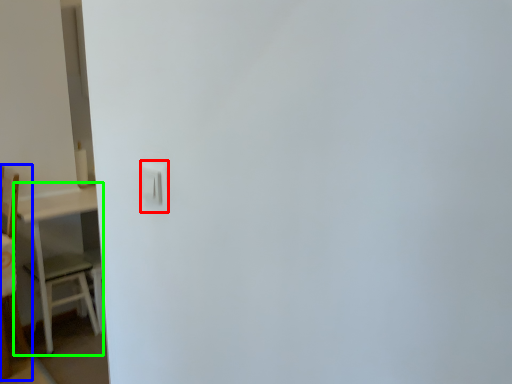
Question: Considering the real-world distances, which object is farthest from light switch (highlighted by a red box)? furniture (highlighted by a blue box) or table (highlighted by a green box)?

Choices:
 (A) furniture
 (B) table

Answer: (B)